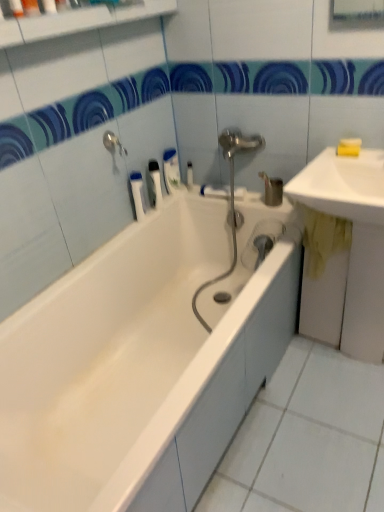
Question: Can you confirm if white glossy sink at upper right, the 1th sink in the top-to-bottom sequence, is taller than white plastic bottle at upper center, the 4th toiletry when ordered from left to right?

Choices:
 (A) no
 (B) yes

Answer: (B)

Question: From a real-world perspective, is white glossy sink at upper right, arranged as the 2th sink when ordered from the bottom, over white plastic bottle at upper center, which ranks as the third toiletry in bottom-to-top order?

Choices:
 (A) yes
 (B) no

Answer: (A)

Question: Are white glossy sink at upper right, arranged as the 2th sink when ordered from the bottom, and white plastic bottle at upper center, which ranks as the third toiletry in bottom-to-top order, beside each other?

Choices:
 (A) yes
 (B) no

Answer: (B)

Question: Does white glossy sink at upper right, arranged as the 2th sink when ordered from the bottom, come in front of white plastic bottle at upper center, which ranks as the 1th toiletry in back-to-front order?

Choices:
 (A) yes
 (B) no

Answer: (A)

Question: From the image's perspective, does white glossy sink at upper right, the 1th sink in the top-to-bottom sequence, appear lower than white plastic bottle at upper center, the 4th toiletry positioned from the front?

Choices:
 (A) yes
 (B) no

Answer: (A)

Question: Considering the relative sizes of white glossy sink at upper right, arranged as the 2th sink when ordered from the bottom, and white plastic bottle at upper center, which is the 1th toiletry from right to left, in the image provided, is white glossy sink at upper right, arranged as the 2th sink when ordered from the bottom, bigger than white plastic bottle at upper center, which is the 1th toiletry from right to left,?

Choices:
 (A) no
 (B) yes

Answer: (B)

Question: Is white plastic toothbrush at upper center, positioned as the third toiletry in left-to-right order, facing towards matte orange soap at upper left, which is counted as the 1th toiletry, starting from the top?

Choices:
 (A) yes
 (B) no

Answer: (B)

Question: Is the depth of white plastic toothbrush at upper center, the 2th toiletry when ordered from right to left, less than that of matte orange soap at upper left, which is counted as the first toiletry, starting from the front?

Choices:
 (A) yes
 (B) no

Answer: (B)

Question: Is white plastic toothbrush at upper center, the 2th toiletry from the bottom, outside matte orange soap at upper left, acting as the 4th toiletry starting from the bottom?

Choices:
 (A) yes
 (B) no

Answer: (A)

Question: From the image's perspective, would you say white plastic toothbrush at upper center, which ranks as the 3th toiletry in top-to-bottom order, is positioned over matte orange soap at upper left, placed as the 1th toiletry when sorted from left to right?

Choices:
 (A) yes
 (B) no

Answer: (B)

Question: Does white plastic toothbrush at upper center, which ranks as the 3th toiletry in top-to-bottom order, appear on the left side of matte orange soap at upper left, placed as the 1th toiletry when sorted from left to right?

Choices:
 (A) no
 (B) yes

Answer: (A)

Question: Is white plastic toothbrush at upper center, acting as the 2th toiletry starting from the back, taller than matte orange soap at upper left, which is counted as the first toiletry, starting from the front?

Choices:
 (A) yes
 (B) no

Answer: (A)

Question: From the image's perspective, is white glossy sink at upper right, arranged as the 2th sink when ordered from the bottom, located beneath yellow matte soap at upper right, which is counted as the first soap, starting from the bottom?

Choices:
 (A) no
 (B) yes

Answer: (B)